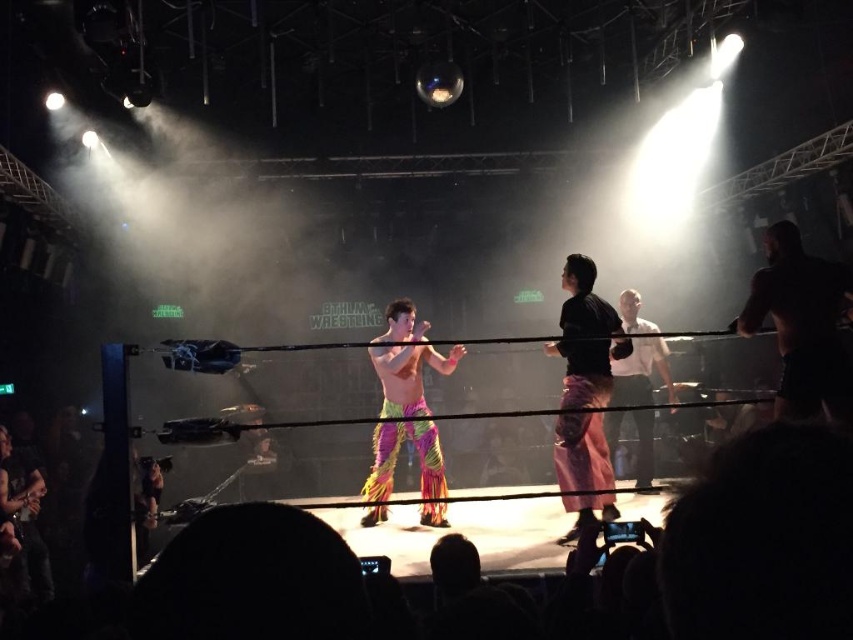
Looking at this image, between multicolored fabric pants at center and white shirt at center, which one is positioned lower?

multicolored fabric pants at center is below.

Which is in front, point (410, 305) or point (665, 374)?

Point (410, 305) is more forward.

Locate an element on the screen. Image resolution: width=853 pixels, height=640 pixels. multicolored fabric pants at center is located at coordinates (396, 458).

Identify the location of multicolored fabric pants at center. (396, 458).

Between shiny black hair at right and white shirt at center, which one is positioned lower?

white shirt at center is below.

Does shiny black hair at right have a greater height compared to white shirt at center?

No, shiny black hair at right is not taller than white shirt at center.

The image size is (853, 640). What do you see at coordinates (804, 326) in the screenshot?
I see `shiny black hair at right` at bounding box center [804, 326].

Locate an element on the screen. The image size is (853, 640). shiny black hair at right is located at coordinates (804, 326).

Is point (602, 481) closer to viewer compared to point (416, 408)?

Yes, point (602, 481) is in front of point (416, 408).

Is point (561, 400) behind point (390, 436)?

No.

At what (x,y) coordinates should I click in order to perform the action: click on black matte shirt at center. Please return your answer as a coordinate pair (x, y). The width and height of the screenshot is (853, 640). Looking at the image, I should click on (585, 337).